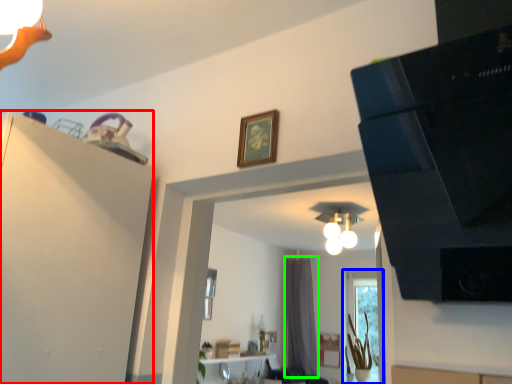
Question: Which object is positioned farthest from dresser (highlighted by a red box)? Select from window (highlighted by a blue box) and curtain (highlighted by a green box).

Choices:
 (A) window
 (B) curtain

Answer: (B)